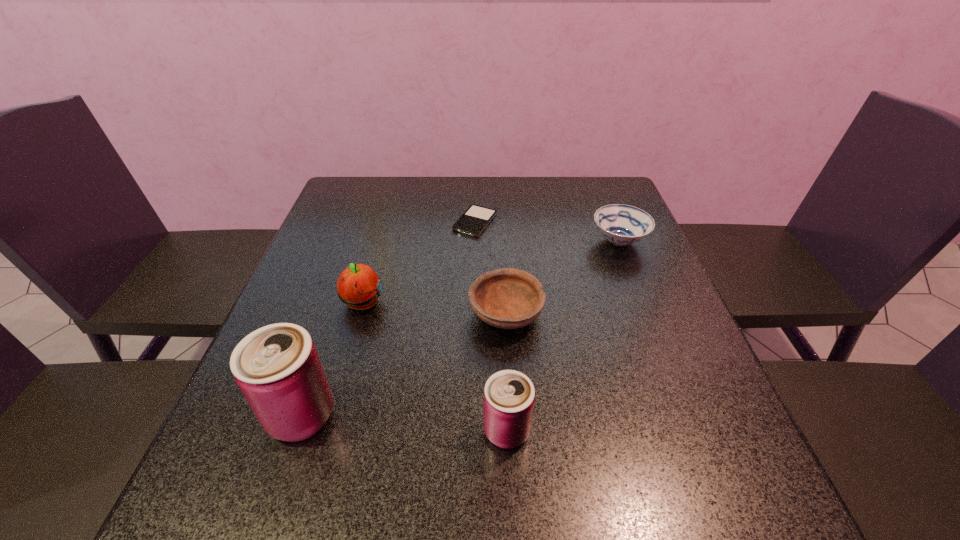
Where is `free space located 0.250m on the back of the rightmost object`? free space located 0.250m on the back of the rightmost object is located at coordinates (595, 181).

You are a GUI agent. You are given a task and a screenshot of the screen. Output one action in this format:
    pyautogui.click(x=<x>, y=<y>)
    Task: Click on the free space located on the left of the shortest object
    The image size is (960, 540).
    Given the screenshot: What is the action you would take?
    pyautogui.click(x=436, y=222)

What are the coordinates of `vacant point located on the back of the bowl` in the screenshot? It's located at (501, 235).

What are the coordinates of `object that is at the far edge` in the screenshot? It's located at (475, 219).

Where is `can at the left edge`? The width and height of the screenshot is (960, 540). can at the left edge is located at coordinates (277, 367).

Where is `apple that is at the left edge`? Image resolution: width=960 pixels, height=540 pixels. apple that is at the left edge is located at coordinates (359, 287).

You are a GUI agent. You are given a task and a screenshot of the screen. Output one action in this format:
    pyautogui.click(x=<x>, y=<y>)
    Task: Click on the object at the right edge
    Image resolution: width=960 pixels, height=540 pixels.
    Given the screenshot: What is the action you would take?
    pyautogui.click(x=620, y=224)

Locate an element on the screen. object situated at the near left corner is located at coordinates (277, 367).

In the image, there is a desktop. Where is `vacant region at the far edge`? vacant region at the far edge is located at coordinates (420, 203).

The image size is (960, 540). Identify the location of vacant space at the left edge of the desktop. (300, 271).